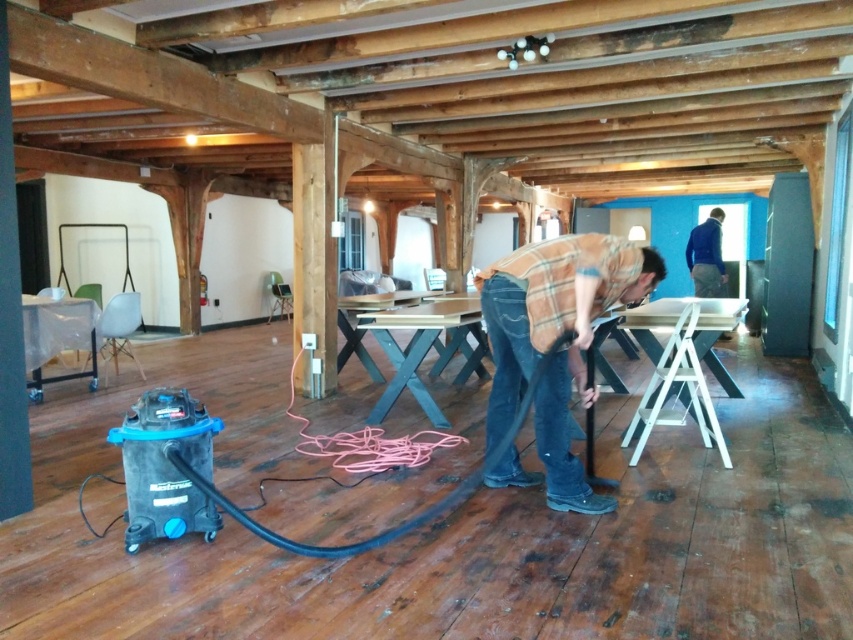
Which is more to the right, brown plaid shirt at center or dark blue sweater at upper right?

dark blue sweater at upper right

Which is in front, point (582, 314) or point (717, 285)?

Positioned in front is point (582, 314).

Find the location of `brown plaid shirt at center`. brown plaid shirt at center is located at coordinates (554, 339).